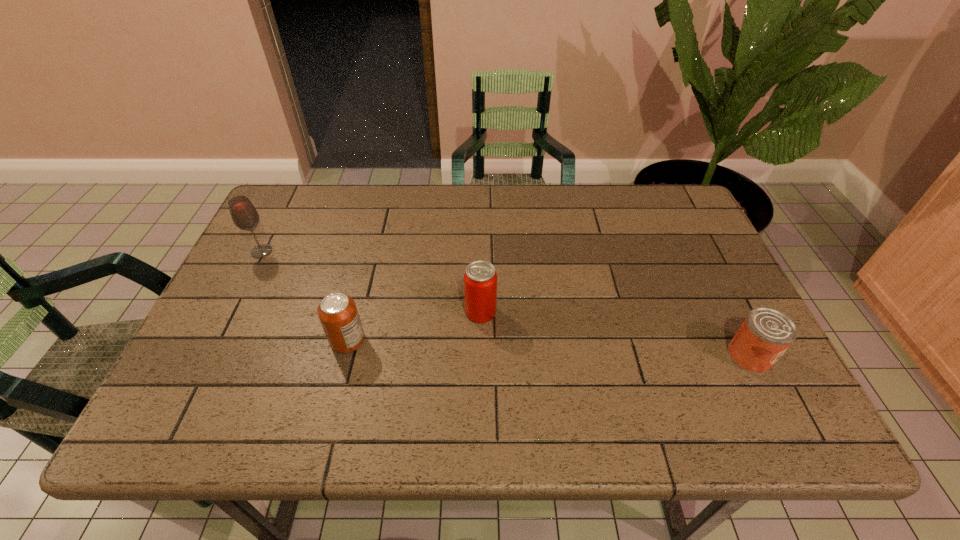
In order to click on the farthest object in this screenshot , I will do `click(243, 213)`.

This screenshot has width=960, height=540. What are the coordinates of `the leftmost object` in the screenshot? It's located at (243, 213).

The width and height of the screenshot is (960, 540). I want to click on the second can from right to left, so click(480, 279).

Find the location of a particular element. This screenshot has height=540, width=960. the third nearest object is located at coordinates (480, 279).

The image size is (960, 540). Find the location of `the second object from left to right`. the second object from left to right is located at coordinates (338, 314).

Where is `the rightmost can`? The image size is (960, 540). the rightmost can is located at coordinates (766, 333).

Locate an element on the screen. This screenshot has height=540, width=960. the rightmost object is located at coordinates (766, 333).

Find the location of a particular element. blank space located 0.240m on the right of the tallest object is located at coordinates (360, 252).

At what (x,y) coordinates should I click in order to perform the action: click on vacant space located 0.140m on the left of the second object from right to left. Please return your answer as a coordinate pair (x, y). Looking at the image, I should click on (407, 312).

This screenshot has height=540, width=960. Identify the location of free space located 0.110m on the front of the leftmost can. (333, 400).